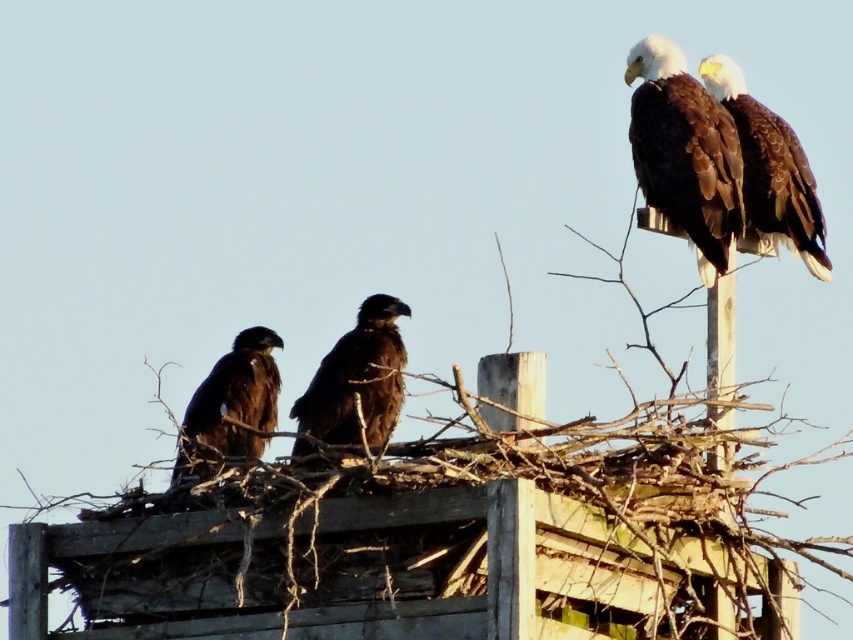
You are standing in front of the wooden structure with the three bald eagles. There are two points marked on the structure. One is at point (782, 120) and the other at point (344, 406). Which point is closer to you?

Point (782, 120) is closer to you because it is further to the viewer than point (344, 406).

You are standing in front of the wooden structure with three bald eagles. You notice a point marked at coordinates (683, 152). Which eagle does this point indicate?

The point marked at coordinates (683, 152) indicates the brown feathered eagle at upper right.

You are a wildlife photographer aiming to capture a closeup of the brown feathered eagle at upper right and the brown feathered eagle at center. Given that your camera lens can only focus on objects within a 1.5 meter width, will both eagles fit in the frame?

The brown feathered eagle at upper right is wider than the brown feathered eagle at center. Since the camera lens can focus on objects within 1.5 meters, the total combined width of both eagles must be considered. However, the exact widths are not provided, so it is uncertain if they will fit together within the 1.5 meter limit.